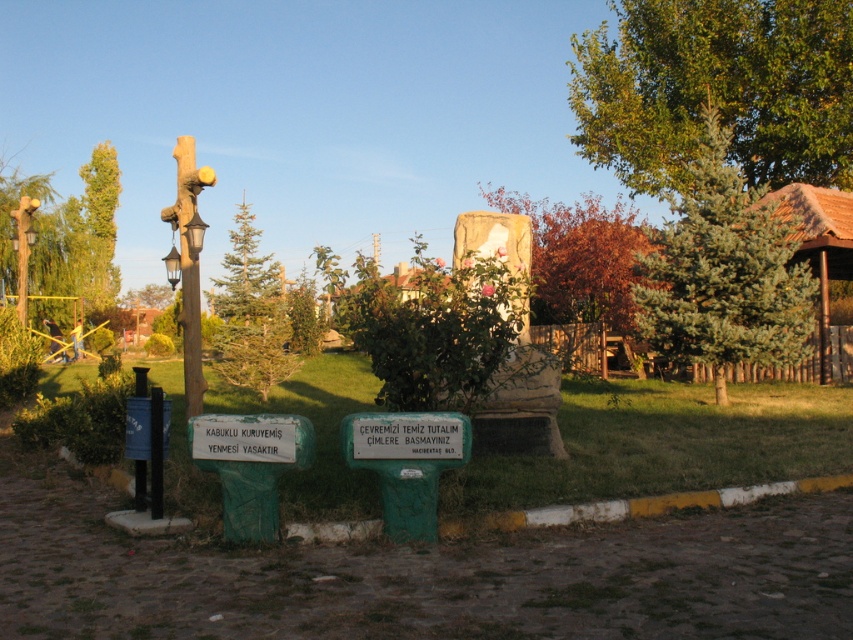
You are standing at the viewpoint of the image and want to estimate how far the green leafy tree at upper left is from your current position. Based on the scene description, can you determine the approximate distance in meters?

The green leafy tree at upper left is approximately 34.57 meters away from the viewer.

You are a drone operator trying to capture a photo of the green leafy tree at upper right. The camera is currently focused on the center of the image. Should you adjust the camera to the left or right to frame the tree properly?

The green leafy tree at upper right is located at point 0.141 on the x and 0.842 on the y. Since the camera is focused on the center, which is at 0.5 on both axes, the tree is to the left and upper part of the image. To frame it properly, adjust the camera to the left and upwards.

You are standing in the park and see the green leafy tree at upper left and the green stone sign at center. Which object is positioned more to the left side of the scene?

The green leafy tree at upper left is positioned more to the left side of the scene than the green stone sign at center.